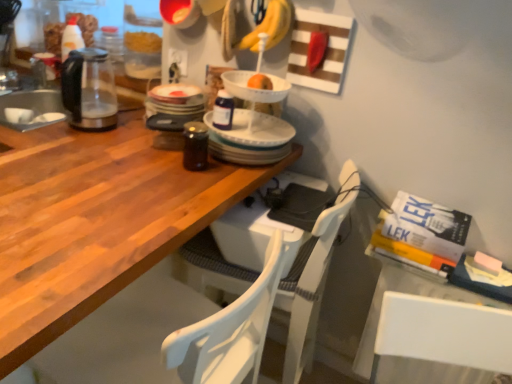
You are a GUI agent. You are given a task and a screenshot of the screen. Output one action in this format:
    pyautogui.click(x=<x>, y=<y>)
    Task: Click on the free spot to the left of transparent glass kettle at left
    Image resolution: width=512 pixels, height=384 pixels.
    Given the screenshot: What is the action you would take?
    pyautogui.click(x=42, y=118)